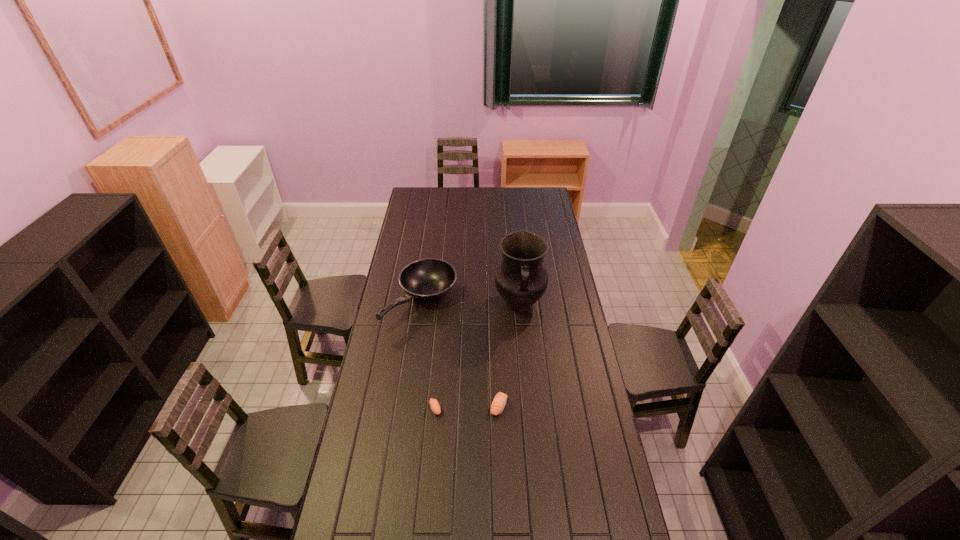
Identify the location of vacant region between the left sushi and the pitcher. The image size is (960, 540). (477, 356).

You are a GUI agent. You are given a task and a screenshot of the screen. Output one action in this format:
    pyautogui.click(x=<x>, y=<y>)
    Task: Click on the free space between the frying pan and the right sushi
    
    Given the screenshot: What is the action you would take?
    pyautogui.click(x=460, y=354)

Locate an element on the screen. free space between the frying pan and the left sushi is located at coordinates (428, 355).

Locate which object is the second closest to the frying pan. Please provide its 2D coordinates. Your answer should be formatted as a tuple, i.e. [(x, y)], where the tuple contains the x and y coordinates of a point satisfying the conditions above.

[(435, 407)]

Where is `the second closest object to the pitcher`? The height and width of the screenshot is (540, 960). the second closest object to the pitcher is located at coordinates (499, 402).

Locate an element on the screen. Image resolution: width=960 pixels, height=540 pixels. vacant area in the image that satisfies the following two spatial constraints: 1. on the front side of the right sushi; 2. on the right side of the second tallest object is located at coordinates (406, 406).

Identify the location of free space that satisfies the following two spatial constraints: 1. on the front side of the second tallest object; 2. on the right side of the right sushi. (406, 406).